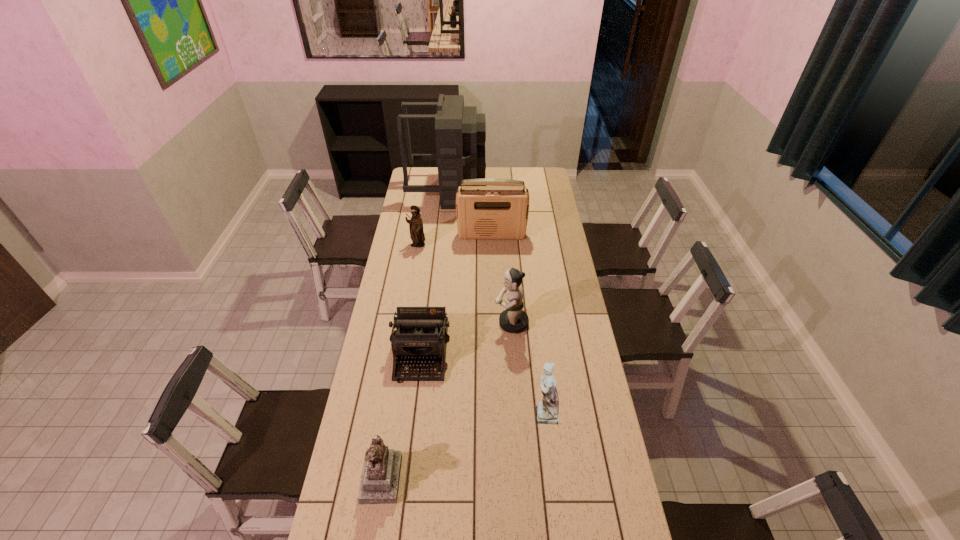
Locate an element on the screen. The image size is (960, 540). free space between the typewriter and the nearest figurine is located at coordinates (401, 415).

Locate an element on the screen. empty location between the radio receiver and the shortest object is located at coordinates (457, 294).

Locate which object ranks in proximity to the second farthest figurine. Please provide its 2D coordinates. Your answer should be formatted as a tuple, i.e. [(x, y)], where the tuple contains the x and y coordinates of a point satisfying the conditions above.

[(421, 335)]

Point out which object is positioned as the fifth nearest to the radio receiver. Please provide its 2D coordinates. Your answer should be formatted as a tuple, i.e. [(x, y)], where the tuple contains the x and y coordinates of a point satisfying the conditions above.

[(547, 410)]

Identify which figurine is the closest to the farthest figurine. Please provide its 2D coordinates. Your answer should be formatted as a tuple, i.e. [(x, y)], where the tuple contains the x and y coordinates of a point satisfying the conditions above.

[(512, 320)]

This screenshot has width=960, height=540. Find the location of `figurine that can be found as the fourth closest to the radio receiver`. figurine that can be found as the fourth closest to the radio receiver is located at coordinates [379, 484].